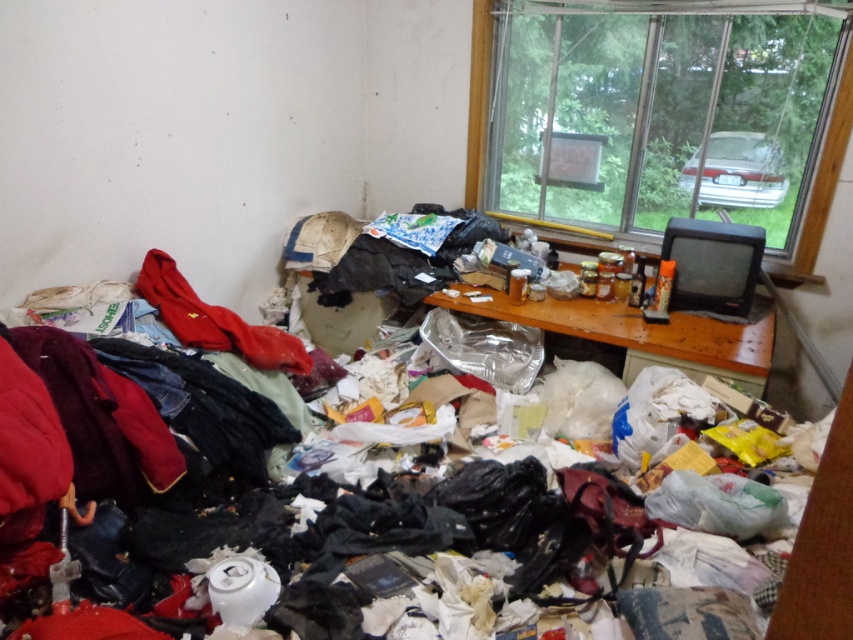
In the scene shown: You are organizing the clutter in the room and need to place the shiny plastic bags at center. Since you want to move them closer to the transparent glass window at upper right, which direction should you move them?

The shiny plastic bags at center should be moved to the right since they are currently on the left side of the transparent glass window at upper right.

You are standing in the cluttered room and want to pick up an item. There are two points marked in the scene, point A at coordinates point (171, 632) and point B at coordinates point (247, 330). Which point is closer to you?

Point A at coordinates point (171, 632) is closer to the viewer than point B at coordinates point (247, 330).